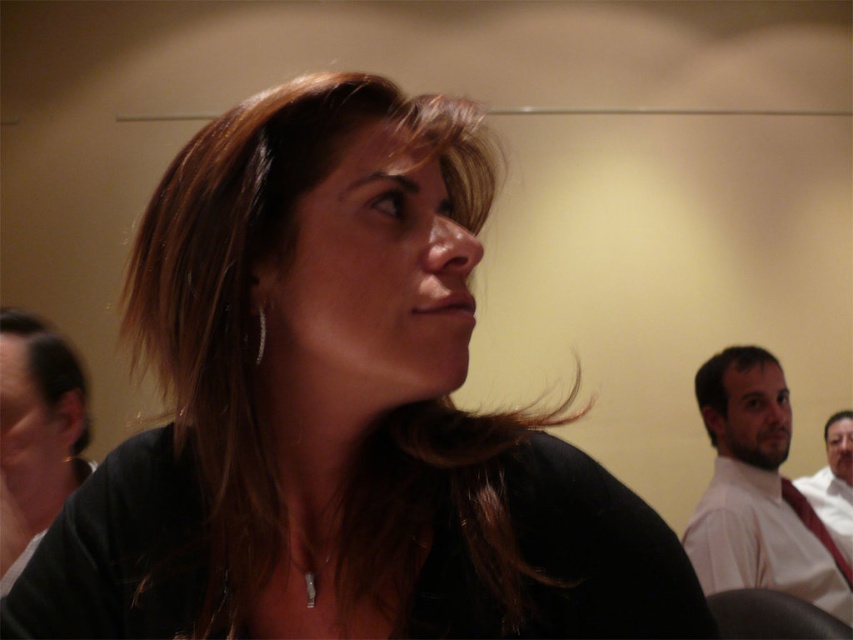
Is red silk tie at right to the left of brownhair at right from the viewer's perspective?

Indeed, red silk tie at right is positioned on the left side of brownhair at right.

Can you confirm if red silk tie at right is shorter than brownhair at right?

No.

Is point (831, 548) in front of point (824, 428)?

Yes.

Where is `red silk tie at right`? The image size is (853, 640). red silk tie at right is located at coordinates (814, 525).

Can you confirm if brownhair at left is shorter than silver metallic earring at upper left?

No, brownhair at left is not shorter than silver metallic earring at upper left.

Which is below, brownhair at left or silver metallic earring at upper left?

brownhair at left

Is point (54, 388) in front of point (260, 355)?

No, it is behind (260, 355).

Locate an element on the screen. The height and width of the screenshot is (640, 853). brownhair at left is located at coordinates (49, 364).

In the scene shown: Measure the distance between white shirt at right and silver metallic earring at upper left.

The distance of white shirt at right from silver metallic earring at upper left is 2.79 meters.

Is white shirt at right taller than silver metallic earring at upper left?

Yes, white shirt at right is taller than silver metallic earring at upper left.

Between point (833, 534) and point (263, 324), which one is positioned behind?

The point (833, 534) is behind.

The image size is (853, 640). In order to click on white shirt at right in this screenshot , I will do `click(833, 481)`.